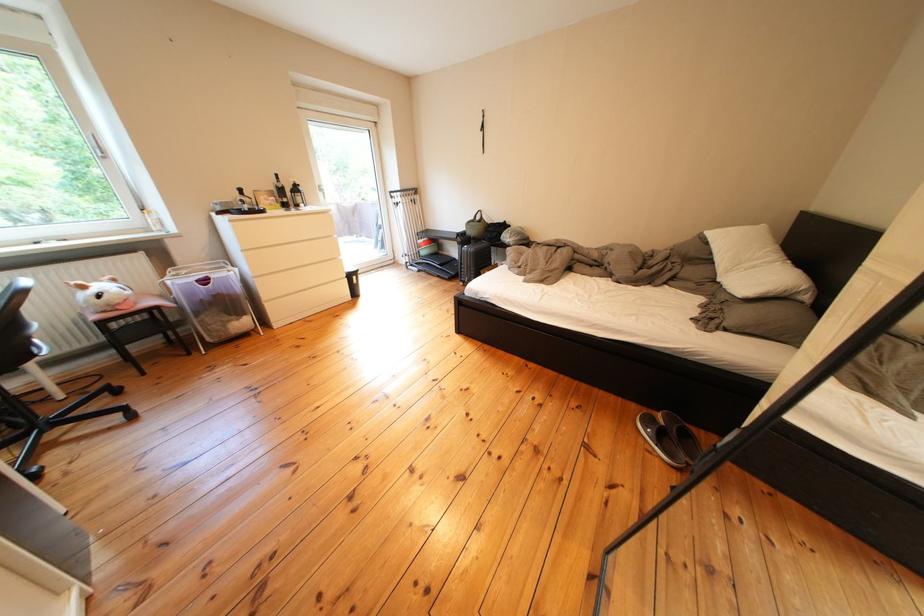
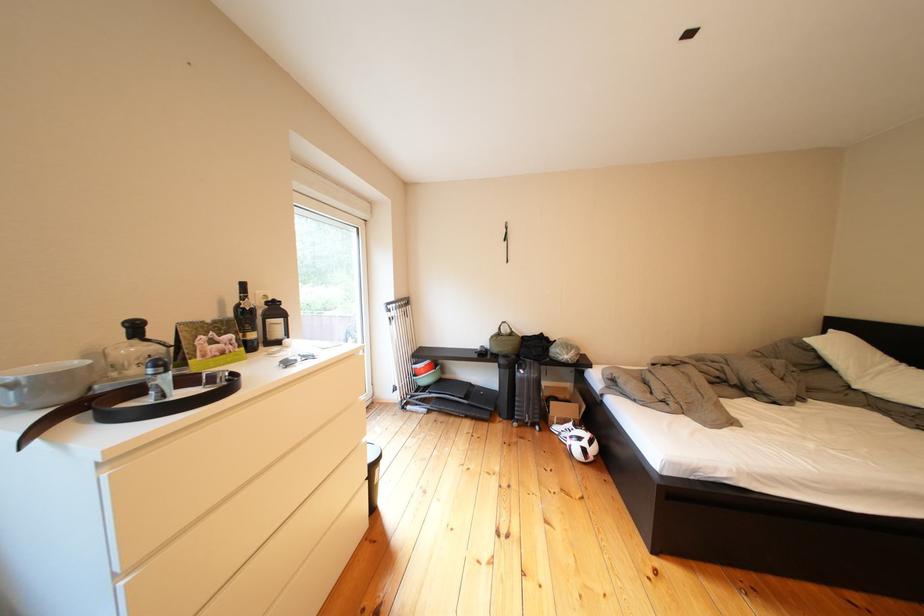
In the second image, find the point that corresponds to pixel 472 244 in the first image.

(516, 366)